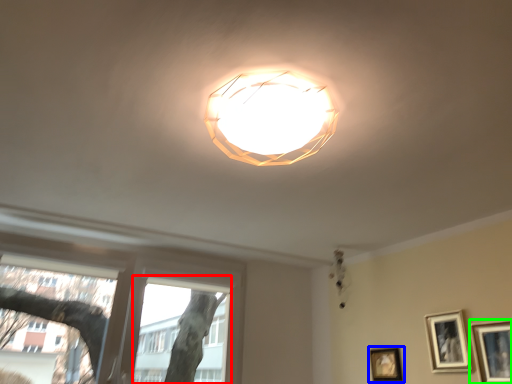
Question: Which is farther away from bay window (highlighted by a red box)? picture frame (highlighted by a blue box) or picture frame (highlighted by a green box)?

Choices:
 (A) picture frame
 (B) picture frame

Answer: (B)